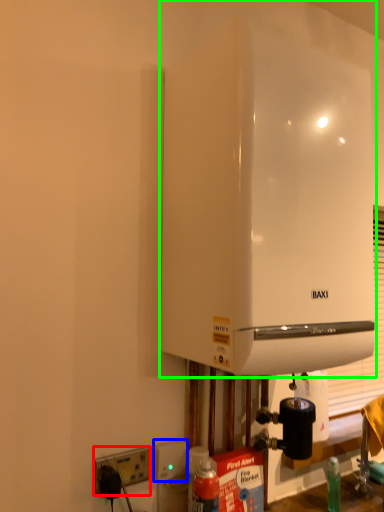
Question: Estimate the real-world distances between objects in this image. Which object is farther from electric outlet (highlighted by a red box), electric outlet (highlighted by a blue box) or home appliance (highlighted by a green box)?

Choices:
 (A) electric outlet
 (B) home appliance

Answer: (B)